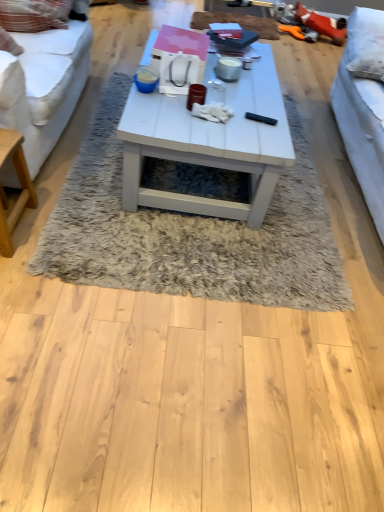
Question: Does white fabric studio couch at left, which is the first studio couch from left to right, appear on the left side of white shaggy rug at center?

Choices:
 (A) no
 (B) yes

Answer: (B)

Question: Does white fabric studio couch at left, arranged as the 2th studio couch when viewed from the right, have a smaller size compared to white shaggy rug at center?

Choices:
 (A) yes
 (B) no

Answer: (B)

Question: Is white fabric studio couch at left, arranged as the 2th studio couch when viewed from the right, bigger than white shaggy rug at center?

Choices:
 (A) yes
 (B) no

Answer: (A)

Question: Is white fabric studio couch at left, arranged as the 2th studio couch when viewed from the right, facing away from white shaggy rug at center?

Choices:
 (A) yes
 (B) no

Answer: (B)

Question: From a real-world perspective, is white fabric studio couch at left, which is the first studio couch from left to right, located beneath white shaggy rug at center?

Choices:
 (A) no
 (B) yes

Answer: (A)

Question: From a real-world perspective, is light brown wooden table at left physically located above or below white shaggy rug at center?

Choices:
 (A) below
 (B) above

Answer: (B)

Question: Is light brown wooden table at left spatially inside white shaggy rug at center, or outside of it?

Choices:
 (A) inside
 (B) outside

Answer: (B)

Question: In terms of width, does light brown wooden table at left look wider or thinner when compared to white shaggy rug at center?

Choices:
 (A) thin
 (B) wide

Answer: (A)

Question: From their relative heights in the image, would you say light brown wooden table at left is taller or shorter than white shaggy rug at center?

Choices:
 (A) short
 (B) tall

Answer: (B)

Question: From a real-world perspective, is white fabric couch at right, positioned as the second studio couch in left-to-right order, positioned above or below light brown wooden table at left?

Choices:
 (A) below
 (B) above

Answer: (B)

Question: In terms of height, does white fabric couch at right, positioned as the second studio couch in left-to-right order, look taller or shorter compared to light brown wooden table at left?

Choices:
 (A) tall
 (B) short

Answer: (A)

Question: From the image's perspective, relative to light brown wooden table at left, is white fabric couch at right, positioned as the second studio couch in left-to-right order, above or below?

Choices:
 (A) above
 (B) below

Answer: (A)

Question: Based on their sizes in the image, would you say white fabric couch at right, positioned as the second studio couch in left-to-right order, is bigger or smaller than light brown wooden table at left?

Choices:
 (A) small
 (B) big

Answer: (B)

Question: Considering the positions of light brown wooden table at left and white matte coffee table at center in the image, is light brown wooden table at left bigger or smaller than white matte coffee table at center?

Choices:
 (A) big
 (B) small

Answer: (B)

Question: Is point (6, 252) positioned closer to the camera than point (268, 193)?

Choices:
 (A) farther
 (B) closer

Answer: (B)